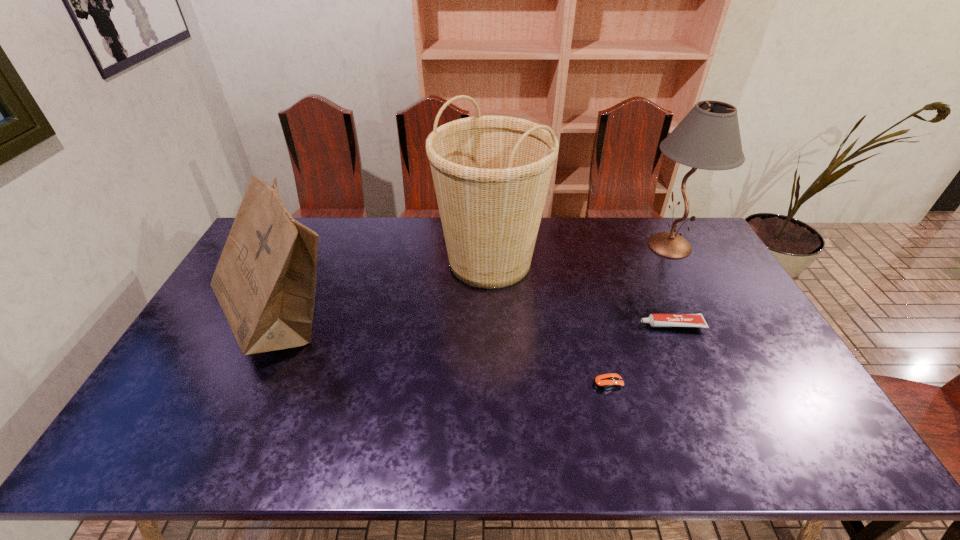
The width and height of the screenshot is (960, 540). I want to click on object situated at the far right corner, so click(708, 137).

What are the coordinates of `free region at the far edge of the desktop` in the screenshot? It's located at (590, 247).

Locate an element on the screen. This screenshot has height=540, width=960. vacant space at the near edge of the desktop is located at coordinates (545, 449).

You are a GUI agent. You are given a task and a screenshot of the screen. Output one action in this format:
    pyautogui.click(x=<x>, y=<y>)
    Task: Click on the free region at the left edge of the desktop
    The width and height of the screenshot is (960, 540).
    Given the screenshot: What is the action you would take?
    pyautogui.click(x=188, y=386)

What are the coordinates of `vacant space at the right edge` in the screenshot? It's located at (782, 383).

You are a GUI agent. You are given a task and a screenshot of the screen. Output one action in this format:
    pyautogui.click(x=<x>, y=<y>)
    Task: Click on the blank space at the near left corner of the desktop
    The image size is (960, 540).
    Given the screenshot: What is the action you would take?
    (x=165, y=453)

Find the location of a particular element. The width and height of the screenshot is (960, 540). vacant area that lies between the fourth tallest object and the computer mouse is located at coordinates (639, 354).

Where is `empty location between the third object from right to left and the basket`? The width and height of the screenshot is (960, 540). empty location between the third object from right to left and the basket is located at coordinates (549, 322).

This screenshot has height=540, width=960. Find the location of `vacant space in between the toothpaste and the third object from left to right`. vacant space in between the toothpaste and the third object from left to right is located at coordinates (639, 354).

Locate an element on the screen. This screenshot has height=540, width=960. free space between the leftmost object and the shortest object is located at coordinates (445, 352).